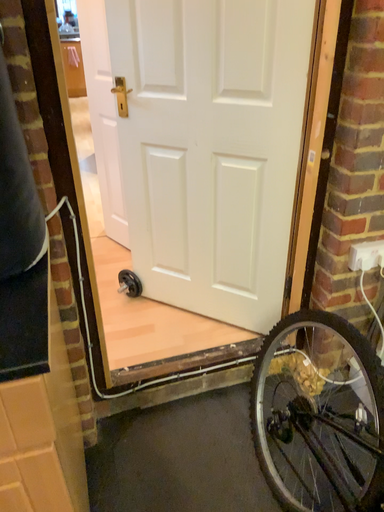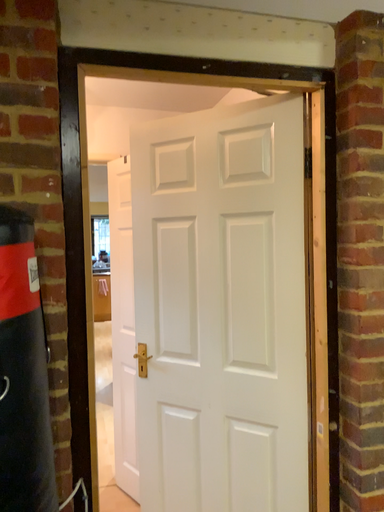
Question: Which way did the camera rotate in the video?

Choices:
 (A) rotated downward
 (B) rotated upward

Answer: (B)